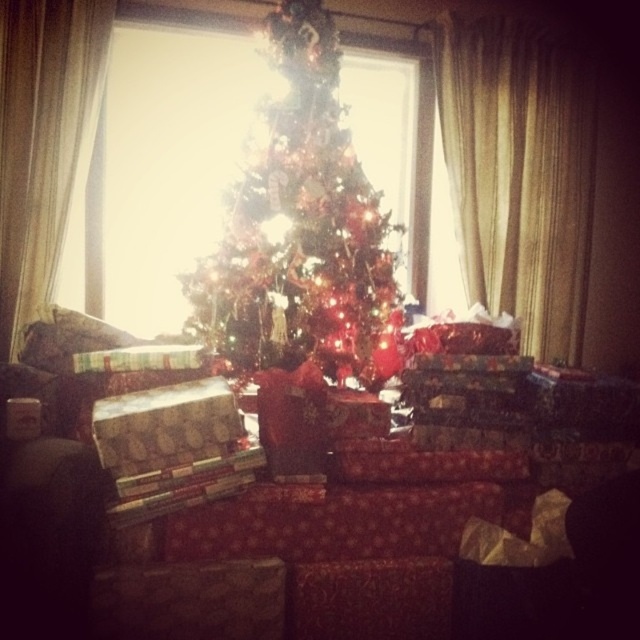
Question: Which of the following is the farthest from the observer?

Choices:
 (A) (314, 52)
 (B) (577, 320)
 (C) (93, 81)

Answer: (B)

Question: Among these points, which one is nearest to the camera?

Choices:
 (A) (461, 29)
 (B) (88, 77)

Answer: (B)

Question: Can you confirm if iridescent glass christmas tree at center is thinner than white sheer curtain at left?

Choices:
 (A) yes
 (B) no

Answer: (B)

Question: Does gold textured curtain at right have a larger size compared to white sheer curtain at left?

Choices:
 (A) no
 (B) yes

Answer: (B)

Question: Where is gold textured curtain at right located in relation to white sheer curtain at left in the image?

Choices:
 (A) above
 (B) below

Answer: (A)

Question: Estimate the real-world distances between objects in this image. Which object is farther from the gold textured curtain at right?

Choices:
 (A) white sheer curtain at left
 (B) iridescent glass christmas tree at center

Answer: (A)